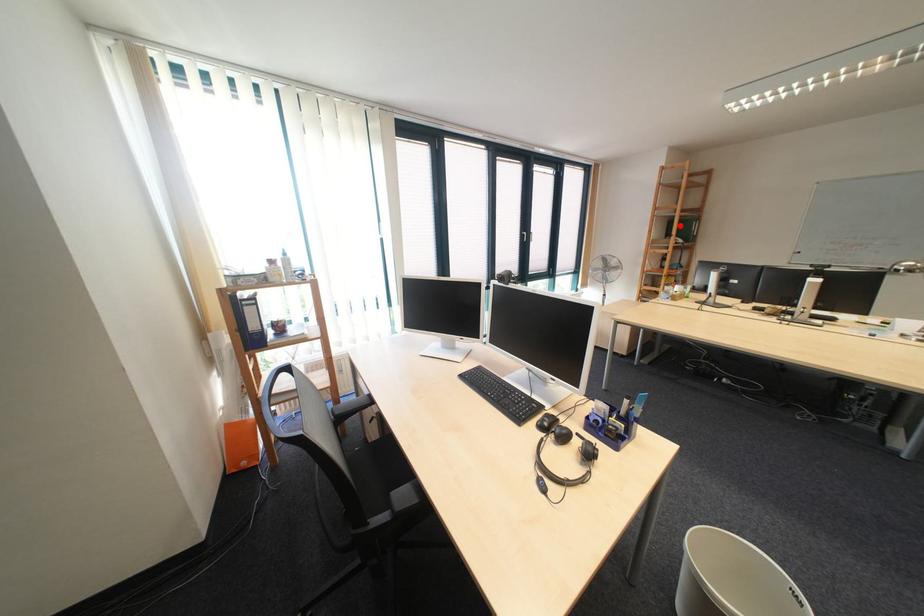
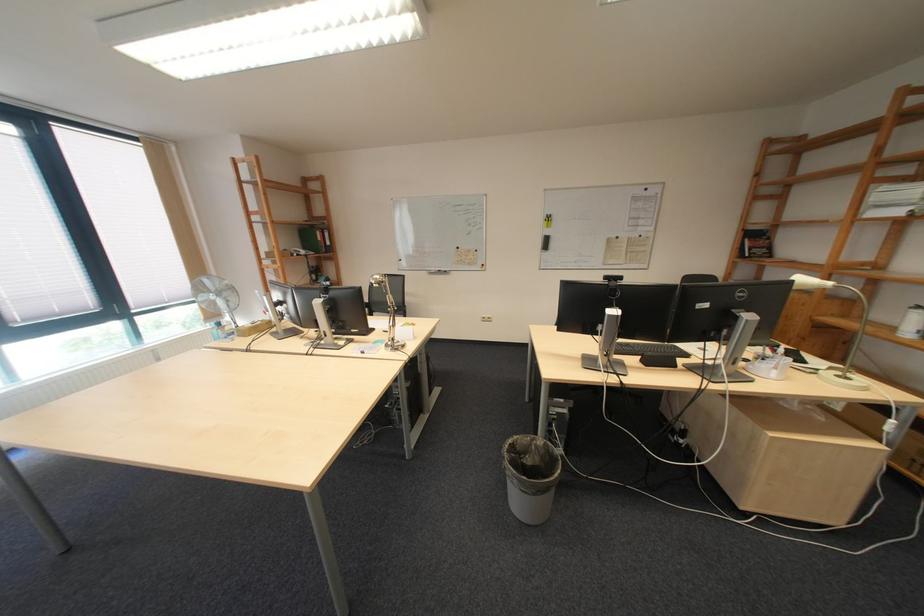
Question: I am providing you with two images of the same scene from different viewpoints. Given a red point in image1, look at the same physical point in image2. Is it:

Choices:
 (A) Closer to the viewpoint
 (B) Farther from the viewpoint

Answer: (A)